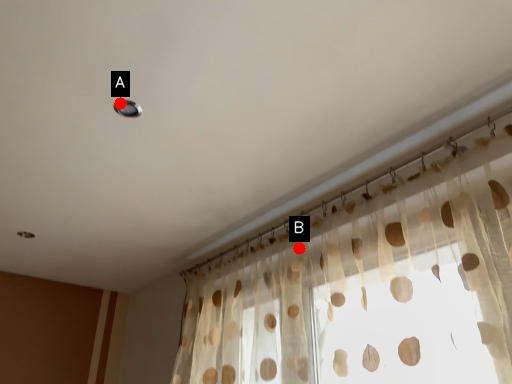
Question: Two points are circled on the image, labeled by A and B beside each circle. Which point is closer to the camera taking this photo?

Choices:
 (A) A is closer
 (B) B is closer

Answer: (A)